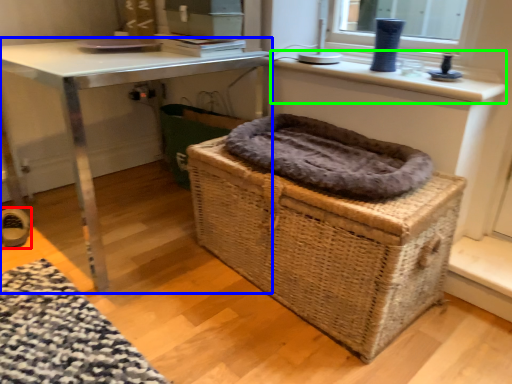
Question: Which object is the farthest from shoe (highlighted by a red box)? Choose among these: table (highlighted by a blue box) or counter top (highlighted by a green box).

Choices:
 (A) table
 (B) counter top

Answer: (B)